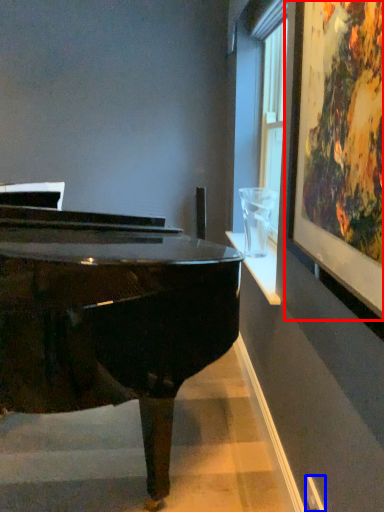
Question: Which object is further to the camera taking this photo, picture frame (highlighted by a red box) or power outlet (highlighted by a blue box)?

Choices:
 (A) picture frame
 (B) power outlet

Answer: (B)